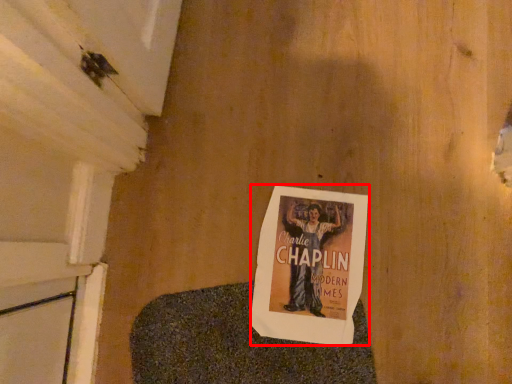
Question: From the image's perspective, where is poster (annotated by the red box) located relative to blanket?

Choices:
 (A) above
 (B) below

Answer: (A)